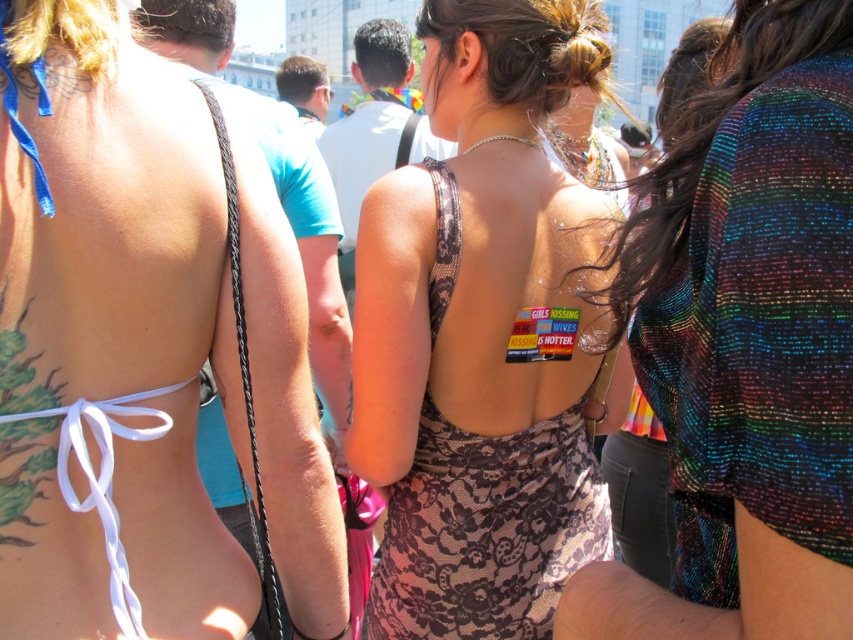
You are a photographer at a beach event and need to capture both the matte black bikini top at center and the brown lace dress at center in a single shot. Given that your camera has a 50mm lens, which has a field of view that can cover a maximum distance of 6 meters between subjects, will you be able to include both in the frame?

The matte black bikini top at center and brown lace dress at center are 6.46 meters apart from each other. Since the maximum distance your camera can cover is 6 meters, you will not be able to include both in the frame as the distance exceeds the camera lens capability.